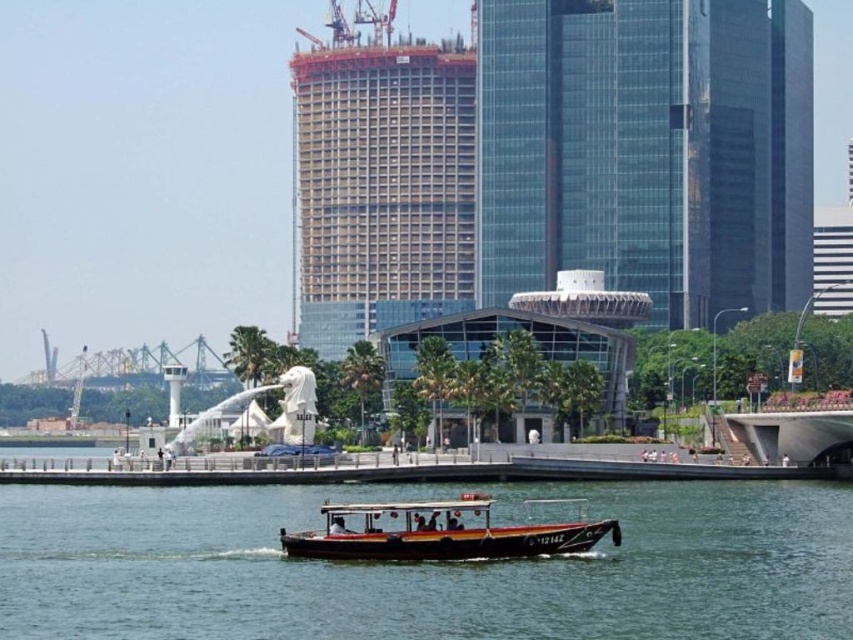
You are a photographer planning to take a photo of the Merlion statue. You want to ensure that both the green water at center and the wooden polished boat at center are visible in the frame. Given their sizes, which object should you focus on to include both in the composition?

The green water at center is larger in size than the wooden polished boat at center, so focusing on the larger green water at center would allow both objects to be included in the frame.

You are a tourist standing on the waterfront and see the green water at center and the wooden polished boat at center. Which object is closer to you?

The green water at center is closer to the viewer than the wooden polished boat at center.

You are a tourist standing at the waterfront and want to take a photo of the Merlion statue. There is a concrete frame building at center in the scene. Will the building block your view of the Merlion statue?

The concrete frame building at center is located at point (381, 186), which does not block the line of sight to the Merlion statue positioned near the waterfront. Therefore, you can take a photo of the Merlion without the building obstructing the view.